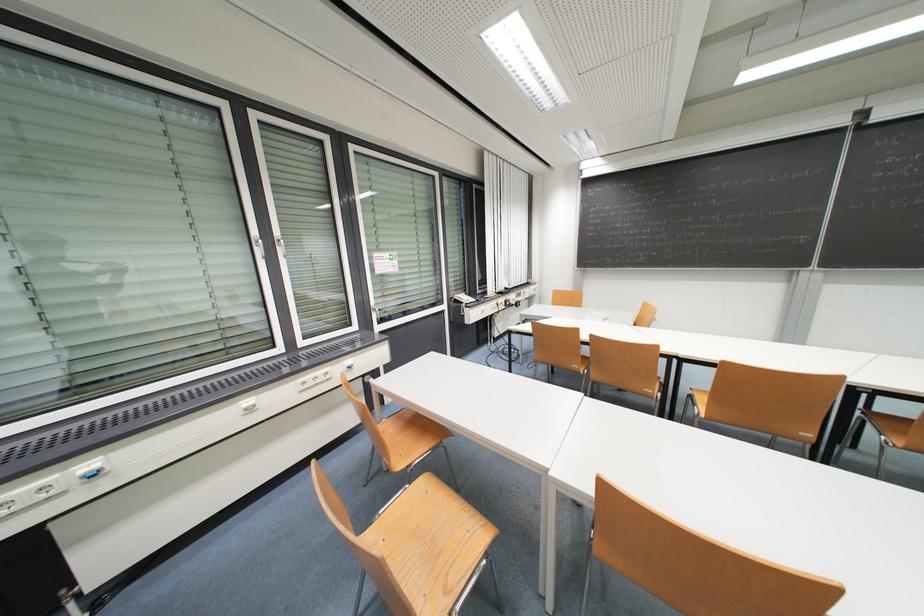
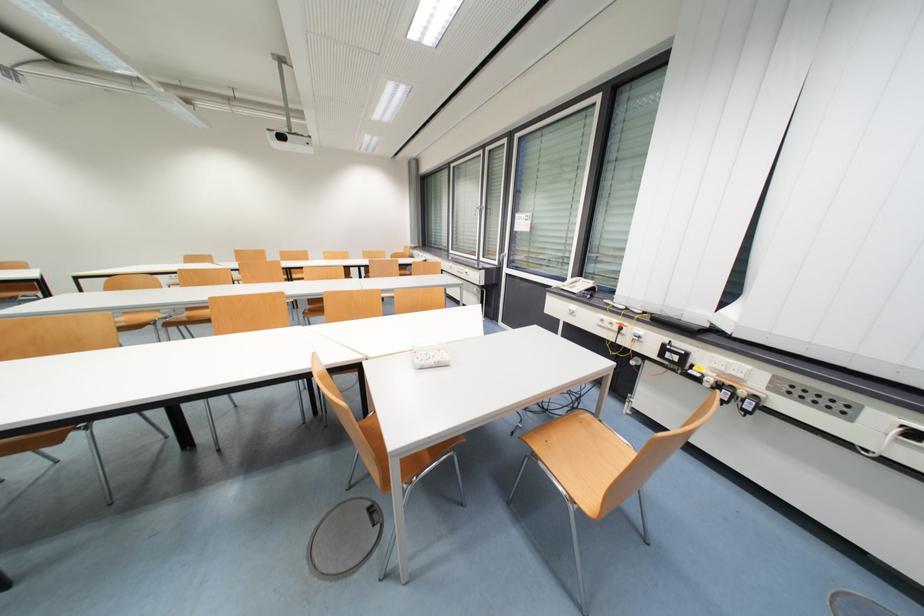
The point at (488, 309) is marked in the first image. Where is the corresponding point in the second image?

(578, 309)